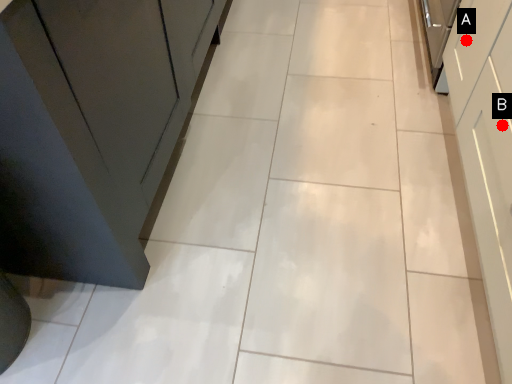
Question: Two points are circled on the image, labeled by A and B beside each circle. Which of the following is the closest to the observer?

Choices:
 (A) A is closer
 (B) B is closer

Answer: (B)